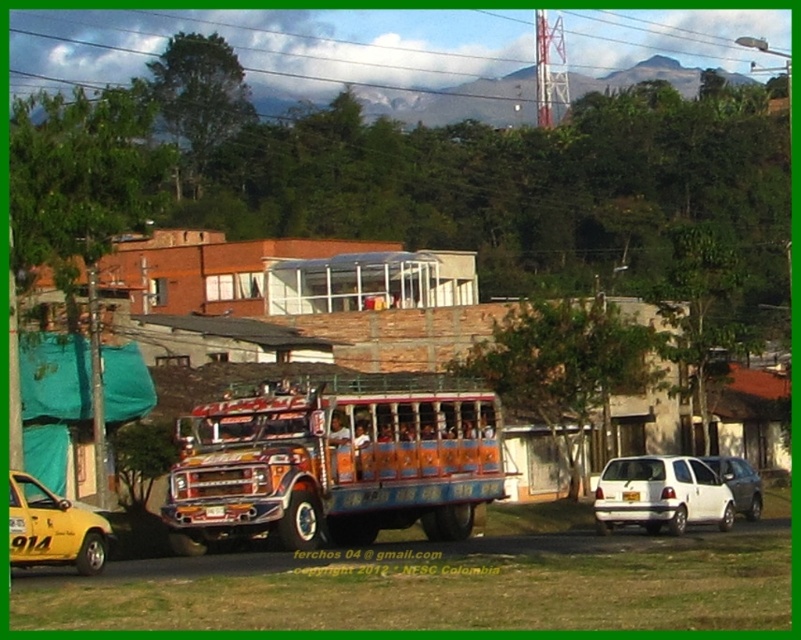
Which is behind, point (75, 568) or point (755, 502)?

Positioned behind is point (755, 502).

Between point (63, 536) and point (747, 508), which one is positioned behind?

Point (747, 508)

Identify the location of yellow matte taxi at lower left. (53, 529).

From the picture: Between white matte hatchback at lower right and white matte van at center, which one appears on the left side from the viewer's perspective?

From the viewer's perspective, white matte hatchback at lower right appears more on the left side.

Between white matte hatchback at lower right and white matte van at center, which one has less height?

white matte hatchback at lower right is shorter.

Where is `white matte hatchback at lower right`? This screenshot has height=640, width=801. white matte hatchback at lower right is located at coordinates coord(659,493).

Where is `white matte hatchback at lower right`? The height and width of the screenshot is (640, 801). white matte hatchback at lower right is located at coordinates pos(659,493).

Describe the element at coordinates (659, 493) in the screenshot. I see `white matte hatchback at lower right` at that location.

Which of these two, white matte hatchback at lower right or yellow matte taxi at lower left, stands shorter?

With less height is yellow matte taxi at lower left.

You are a GUI agent. You are given a task and a screenshot of the screen. Output one action in this format:
    pyautogui.click(x=<x>, y=<y>)
    Task: Click on the white matte hatchback at lower right
    The height and width of the screenshot is (640, 801).
    Given the screenshot: What is the action you would take?
    pyautogui.click(x=659, y=493)

Identify the location of white matte hatchback at lower right. (659, 493).